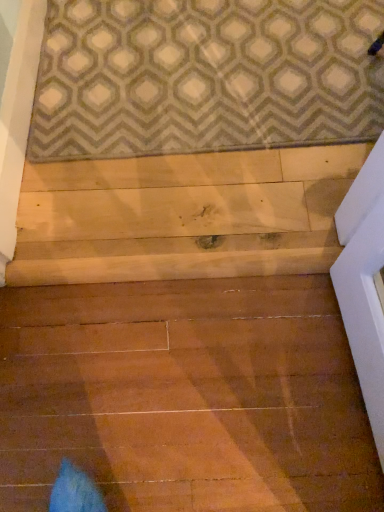
Where is `patterned carpet at upper center`? patterned carpet at upper center is located at coordinates click(x=204, y=76).

What do you see at coordinates (204, 76) in the screenshot?
I see `patterned carpet at upper center` at bounding box center [204, 76].

Measure the distance between point (203, 2) and camera.

They are 1.40 meters apart.

The width and height of the screenshot is (384, 512). Find the location of `patterned carpet at upper center`. patterned carpet at upper center is located at coordinates (204, 76).